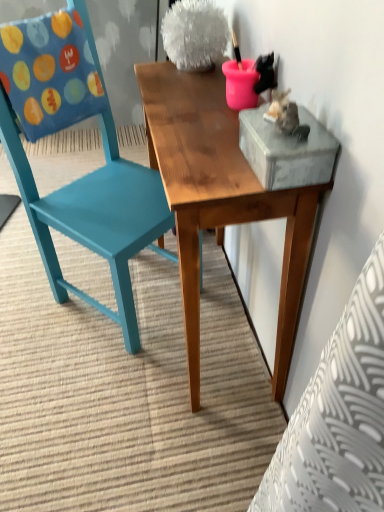
I want to click on free point to the left of teal painted wood chair at left, so click(x=30, y=295).